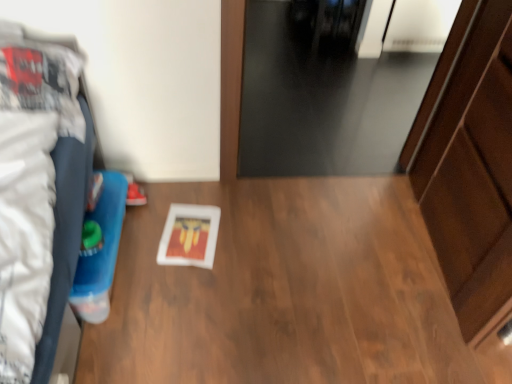
Question: Would you say black glass door at upper center is outside wooden table at center?

Choices:
 (A) no
 (B) yes

Answer: (B)

Question: Considering the relative sizes of black glass door at upper center and wooden table at center in the image provided, is black glass door at upper center thinner than wooden table at center?

Choices:
 (A) no
 (B) yes

Answer: (A)

Question: From a real-world perspective, is black glass door at upper center below wooden table at center?

Choices:
 (A) yes
 (B) no

Answer: (A)

Question: Is black glass door at upper center directly adjacent to wooden table at center?

Choices:
 (A) no
 (B) yes

Answer: (A)

Question: Would you say black glass door at upper center contains wooden table at center?

Choices:
 (A) no
 (B) yes

Answer: (A)

Question: Is black glass door at upper center aimed at wooden table at center?

Choices:
 (A) yes
 (B) no

Answer: (A)

Question: Is wooden table at center not inside wooden dresser at right?

Choices:
 (A) no
 (B) yes

Answer: (B)

Question: Does wooden table at center lie in front of wooden dresser at right?

Choices:
 (A) yes
 (B) no

Answer: (B)

Question: Considering the relative positions of wooden table at center and wooden dresser at right in the image provided, is wooden table at center to the right of wooden dresser at right from the viewer's perspective?

Choices:
 (A) no
 (B) yes

Answer: (A)

Question: Is wooden table at center smaller than wooden dresser at right?

Choices:
 (A) yes
 (B) no

Answer: (A)

Question: Does wooden table at center have a lesser height compared to wooden dresser at right?

Choices:
 (A) yes
 (B) no

Answer: (A)

Question: Is wooden table at center not near wooden dresser at right?

Choices:
 (A) yes
 (B) no

Answer: (B)

Question: Does wooden dresser at right appear on the left side of black glass door at upper center?

Choices:
 (A) no
 (B) yes

Answer: (A)